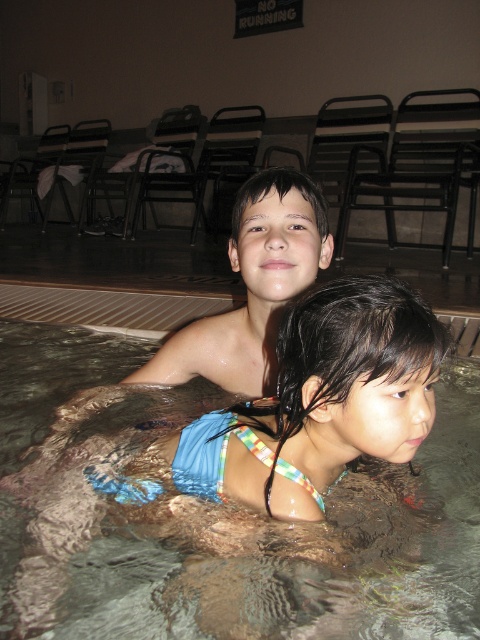
You are a lifeguard on duty and you notice a clear plastic water at upper center in the pool. Where exactly is it located in the pool? Please provide coordinates in the format of x,y between 0 and 1.

The clear plastic water at upper center is located at coordinates (252,541).

You are a photographer taking a picture of the smooth skin boy at upper center and the clear plastic water at upper center. Which object is positioned closer to the camera?

The clear plastic water at upper center is closer to the viewer than the smooth skin boy at upper center, so it is closer to the camera.

You are a photographer trying to capture a shot of the two children in the swimming pool. You want to ensure that the clear plastic water at upper center and the smooth skin boy at upper center are both in focus. Which object should you adjust your camera focus to first to ensure both are sharp?

The clear plastic water at upper center is positioned on the left side of smooth skin boy at upper center. To ensure both are in focus, you should focus on the clear plastic water at upper center first since it is closer to the camera, allowing the depth of field to extend to the smooth skin boy at upper center on the right.